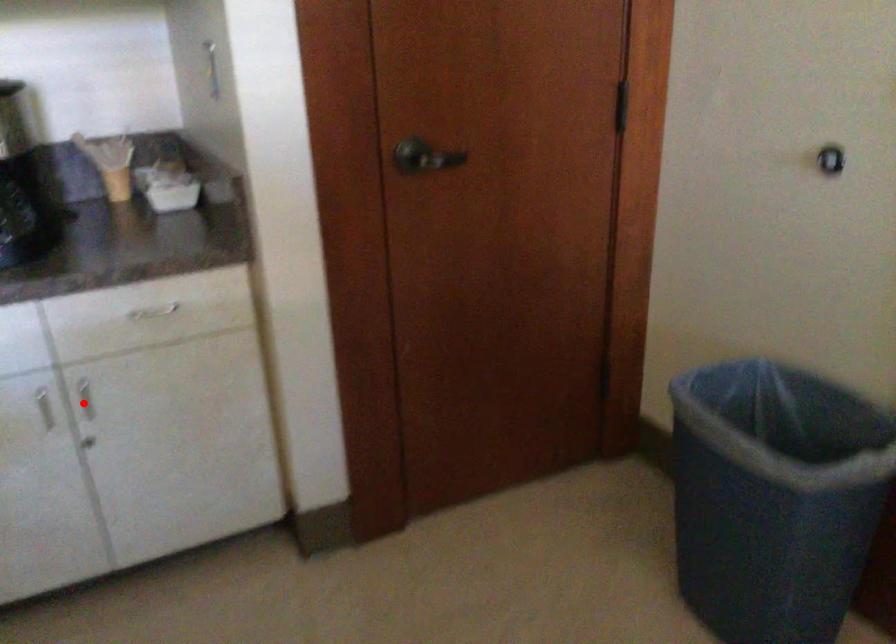
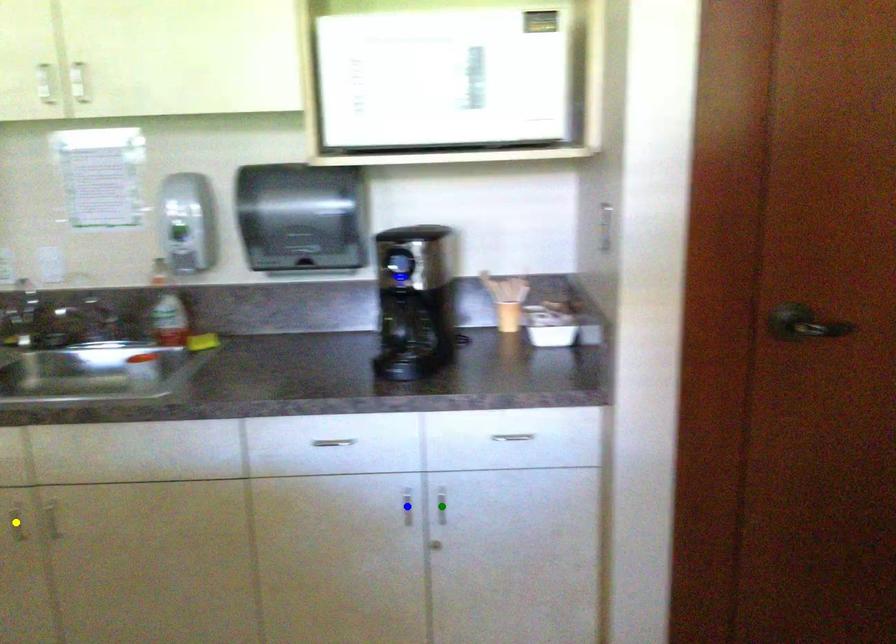
Question: I am providing you with two images of the same scene from different viewpoints. A red point is marked on the first image. You are given multiple points on the second image. Which point in image 2 represents the same 3d spot as the red point in image 1?

Choices:
 (A) yellow point
 (B) blue point
 (C) green point

Answer: (C)